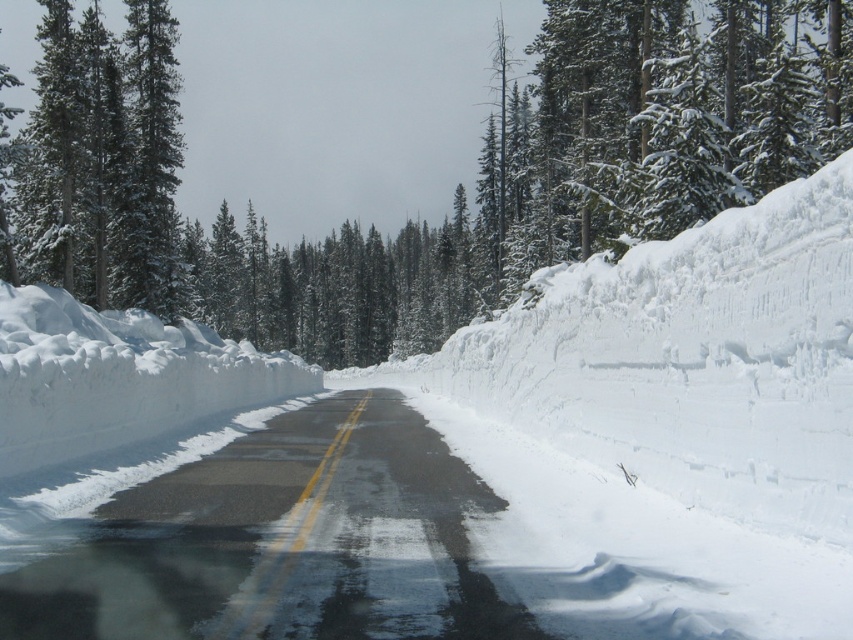
Question: Which of the following is the closest to the observer?

Choices:
 (A) (437, 522)
 (B) (161, 26)

Answer: (A)

Question: Where is glossy asphalt road at center located in relation to green textured pine trees at left in the image?

Choices:
 (A) above
 (B) below

Answer: (B)

Question: Is glossy asphalt road at center above green textured pine trees at left?

Choices:
 (A) yes
 (B) no

Answer: (B)

Question: Which of the following is the closest to the observer?

Choices:
 (A) green textured pine trees at left
 (B) glossy asphalt road at center

Answer: (B)

Question: Which object appears closest to the camera in this image?

Choices:
 (A) green textured pine trees at left
 (B) glossy asphalt road at center

Answer: (B)

Question: Is the position of glossy asphalt road at center more distant than that of green textured pine trees at left?

Choices:
 (A) yes
 (B) no

Answer: (B)